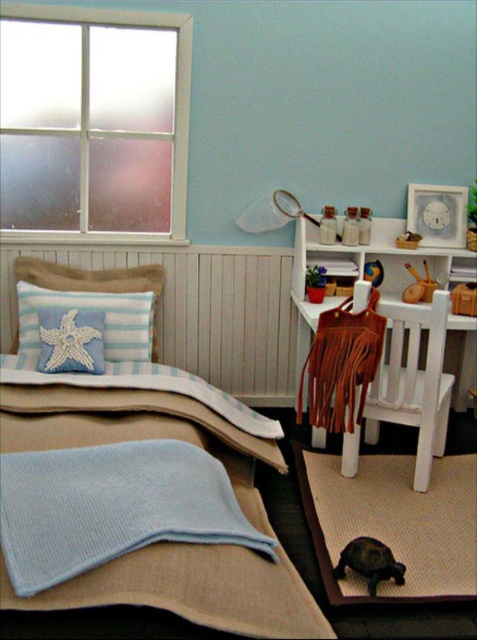
Does frosted glass window at upper left appear over light blue knitted blanket at lower left?

Yes.

Who is taller, frosted glass window at upper left or light blue knitted blanket at lower left?

With more height is frosted glass window at upper left.

The height and width of the screenshot is (640, 477). What are the coordinates of `frosted glass window at upper left` in the screenshot? It's located at (93, 122).

Identify the location of frosted glass window at upper left. The width and height of the screenshot is (477, 640). (93, 122).

Can you confirm if blue textured blanket at lower left is positioned below black rubber turtle at lower right?

No, blue textured blanket at lower left is not below black rubber turtle at lower right.

This screenshot has width=477, height=640. Describe the element at coordinates (193, 589) in the screenshot. I see `blue textured blanket at lower left` at that location.

Which is in front, point (11, 440) or point (352, 538)?

Point (11, 440) is more forward.

What are the coordinates of `blue textured blanket at lower left` in the screenshot? It's located at (193, 589).

In the scene shown: Can you confirm if light blue knitted blanket at lower left is thinner than brown textured mat at lower center?

No, light blue knitted blanket at lower left is not thinner than brown textured mat at lower center.

In the scene shown: Between light blue knitted blanket at lower left and brown textured mat at lower center, which one has more height?

With more height is light blue knitted blanket at lower left.

Is point (47, 524) positioned before point (322, 468)?

Yes, it is.

Identify the location of light blue knitted blanket at lower left. The image size is (477, 640). (113, 508).